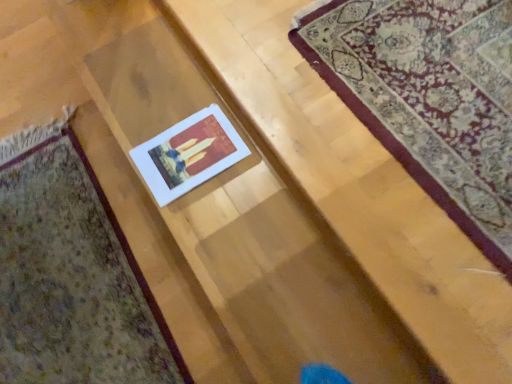
I want to click on free point above matte paper card at center (from a real-world perspective), so click(x=66, y=256).